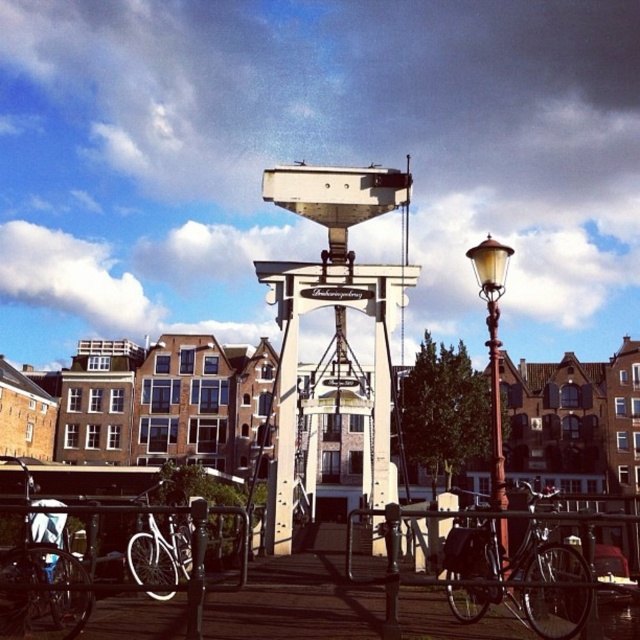
Based on the photo, does shiny silver bicycle at lower right have a lesser height compared to white matte bicycle at lower left?

No, shiny silver bicycle at lower right is not shorter than white matte bicycle at lower left.

Identify the location of shiny silver bicycle at lower right. The image size is (640, 640). (513, 556).

How far apart are shiny silver bicycle at lower right and silver metallic bicycle at lower left?

shiny silver bicycle at lower right and silver metallic bicycle at lower left are 110.78 feet apart from each other.

Between point (518, 595) and point (61, 504), which one is positioned behind?

The point (61, 504) is behind.

The width and height of the screenshot is (640, 640). In order to click on shiny silver bicycle at lower right in this screenshot , I will do `click(513, 556)`.

Who is positioned more to the right, silver metallic bicycle at lower left or white matte bicycle at lower left?

white matte bicycle at lower left

Is point (60, 609) positioned after point (157, 579)?

No.

Which is in front, point (38, 600) or point (150, 572)?

Point (38, 600)

You are a GUI agent. You are given a task and a screenshot of the screen. Output one action in this format:
    pyautogui.click(x=<x>, y=<y>)
    Task: Click on the silver metallic bicycle at lower left
    Image resolution: width=640 pixels, height=640 pixels.
    Given the screenshot: What is the action you would take?
    pyautogui.click(x=42, y=582)